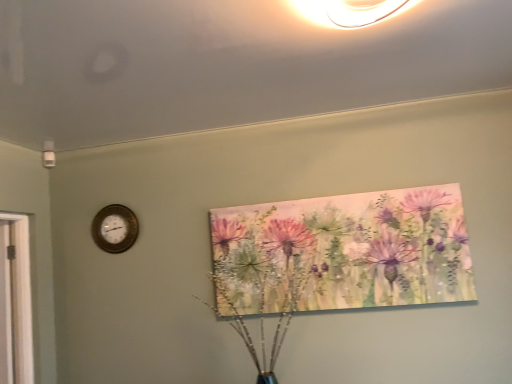
The width and height of the screenshot is (512, 384). What do you see at coordinates (346, 251) in the screenshot?
I see `watercolor painting at upper center` at bounding box center [346, 251].

Find the location of a particular element. The image size is (512, 384). watercolor painting at upper center is located at coordinates (346, 251).

Find the location of `wooden clock at left`. wooden clock at left is located at coordinates (115, 228).

Image resolution: width=512 pixels, height=384 pixels. Describe the element at coordinates (115, 228) in the screenshot. I see `wooden clock at left` at that location.

The image size is (512, 384). What are the coordinates of `watercolor painting at upper center` in the screenshot? It's located at (346, 251).

Can you confirm if watercolor painting at upper center is positioned to the left of wooden clock at left?

No, watercolor painting at upper center is not to the left of wooden clock at left.

Is watercolor painting at upper center behind wooden clock at left?

That is False.

Considering the points (348, 290) and (116, 247), which point is in front, point (348, 290) or point (116, 247)?

The point (348, 290) is closer.

From the image's perspective, which is below, watercolor painting at upper center or wooden clock at left?

watercolor painting at upper center, from the image's perspective.

Looking at this image, from a real-world perspective, is watercolor painting at upper center on wooden clock at left?

No.

Does watercolor painting at upper center have a greater width compared to wooden clock at left?

Yes, watercolor painting at upper center is wider than wooden clock at left.

Considering the sizes of objects watercolor painting at upper center and wooden clock at left in the image provided, who is shorter, watercolor painting at upper center or wooden clock at left?

Standing shorter between the two is wooden clock at left.

Is watercolor painting at upper center smaller than wooden clock at left?

Actually, watercolor painting at upper center might be larger than wooden clock at left.

Which is correct: watercolor painting at upper center is inside wooden clock at left, or outside of it?

watercolor painting at upper center lies outside wooden clock at left.

Is watercolor painting at upper center far from wooden clock at left?

Indeed, watercolor painting at upper center is not near wooden clock at left.

Does watercolor painting at upper center turn towards wooden clock at left?

No, watercolor painting at upper center does not turn towards wooden clock at left.

Identify the location of floral arrangement below the wooden clock at left (from a real-world perspective). (346, 251).

Between wooden clock at left and watercolor painting at upper center, which one appears on the right side from the viewer's perspective?

watercolor painting at upper center.

Which object is further away from the camera, wooden clock at left or watercolor painting at upper center?

wooden clock at left is behind.

Which is behind, point (120, 222) or point (406, 252)?

Positioned behind is point (120, 222).

From the image's perspective, is wooden clock at left located above watercolor painting at upper center?

Yes, from the image's perspective, wooden clock at left is above watercolor painting at upper center.

From a real-world perspective, which is physically below, wooden clock at left or watercolor painting at upper center?

watercolor painting at upper center, from a real-world perspective.

Can you confirm if wooden clock at left is wider than watercolor painting at upper center?

Incorrect, the width of wooden clock at left does not surpass that of watercolor painting at upper center.

Which of these two, wooden clock at left or watercolor painting at upper center, stands taller?

Standing taller between the two is watercolor painting at upper center.

Which of these two, wooden clock at left or watercolor painting at upper center, is smaller?

With smaller size is wooden clock at left.

Consider the image. Is wooden clock at left surrounding watercolor painting at upper center?

Actually, watercolor painting at upper center is outside wooden clock at left.

Are wooden clock at left and watercolor painting at upper center located far from each other?

wooden clock at left is positioned a significant distance from watercolor painting at upper center.

Is wooden clock at left facing away from watercolor painting at upper center?

That's not correct — wooden clock at left is not looking away from watercolor painting at upper center.

Find the location of a particular element. floral arrangement in front of the wooden clock at left is located at coordinates (346, 251).

I want to click on floral arrangement on the right of wooden clock at left, so click(346, 251).

Where is `floral arrangement in front of the wooden clock at left`? The image size is (512, 384). floral arrangement in front of the wooden clock at left is located at coordinates point(346,251).